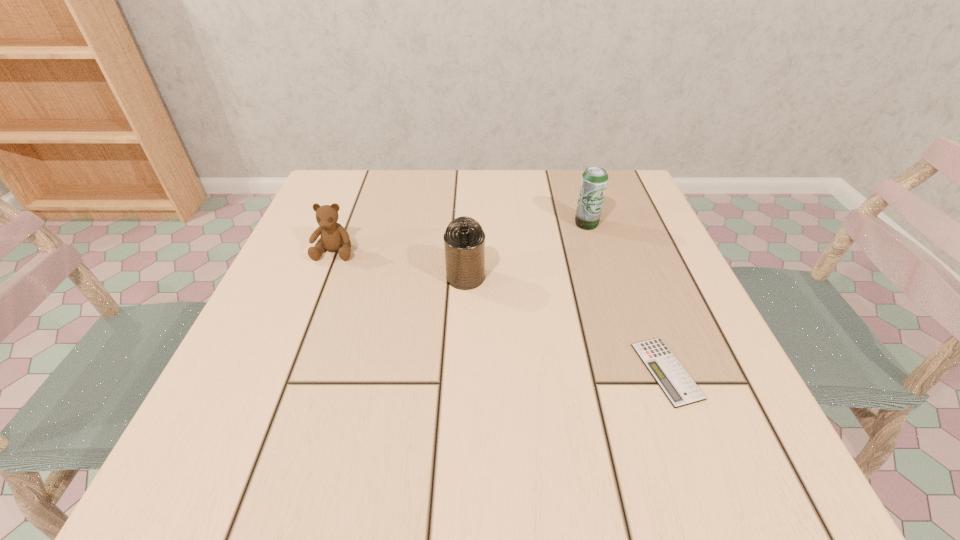
Locate an element on the screen. vacant space at the far left corner of the desktop is located at coordinates (362, 169).

Where is `vacant region at the near left corner of the desktop`? vacant region at the near left corner of the desktop is located at coordinates (280, 461).

The width and height of the screenshot is (960, 540). Identify the location of vacant space at the far right corner of the desktop. (617, 176).

At what (x,y) coordinates should I click in order to perform the action: click on free space between the leftmost object and the can. Please return your answer as a coordinate pair (x, y). This screenshot has height=540, width=960. Looking at the image, I should click on (400, 264).

Where is `vacant area that lies between the second shortest object and the can`? This screenshot has height=540, width=960. vacant area that lies between the second shortest object and the can is located at coordinates (400, 264).

Locate an element on the screen. This screenshot has width=960, height=540. vacant point located between the shortest object and the beer can is located at coordinates (627, 298).

Identify the location of empty space that is in between the farthest object and the can. (526, 251).

Identify the location of free spot between the can and the beer can. The width and height of the screenshot is (960, 540). (x=526, y=251).

This screenshot has height=540, width=960. I want to click on free space between the third object from right to left and the beer can, so click(x=526, y=251).

Find the location of a particular element. Image resolution: width=960 pixels, height=540 pixels. empty location between the third farthest object and the third tallest object is located at coordinates (400, 264).